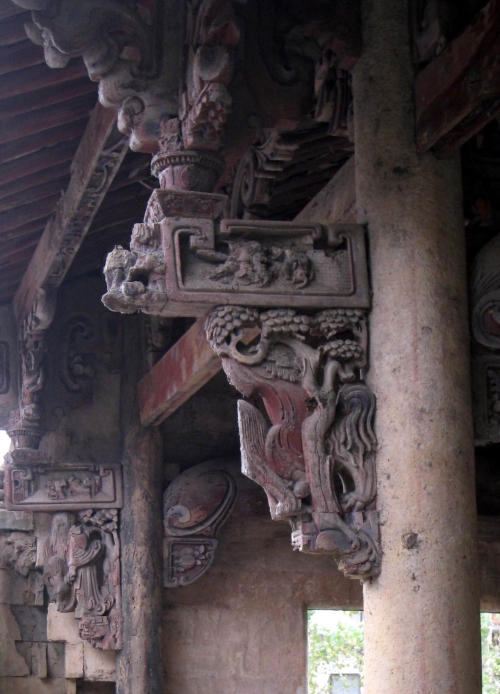
You are a GUI agent. You are given a task and a screenshot of the screen. Output one action in this format:
    pyautogui.click(x=<x>, y=<y>)
    Task: Click on the board
    The image size is (500, 694).
    Given the screenshot: What is the action you would take?
    pyautogui.click(x=26, y=223), pyautogui.click(x=21, y=246), pyautogui.click(x=16, y=264), pyautogui.click(x=8, y=277), pyautogui.click(x=10, y=287), pyautogui.click(x=35, y=210)